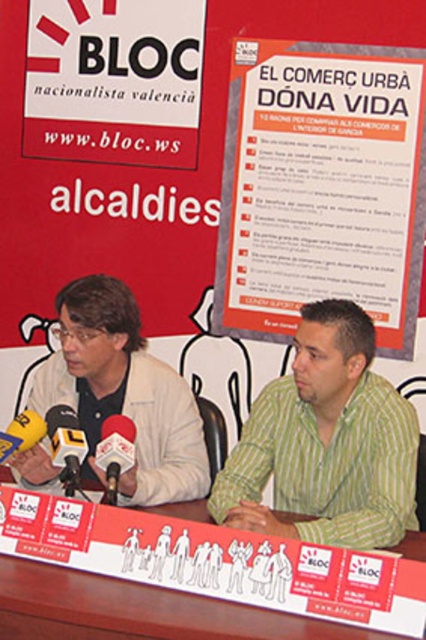
Question: In this image, where is green striped shirt at center located relative to wooden table at lower center?

Choices:
 (A) left
 (B) right

Answer: (B)

Question: Which of the following is the closest to the observer?

Choices:
 (A) metallic silver microphone at lower left
 (B) matte white microphone at center

Answer: (B)

Question: Is metallic silver microphone at lower left thinner than matte white microphone at center?

Choices:
 (A) no
 (B) yes

Answer: (A)

Question: Is matte beige jacket at left closer to the viewer compared to metallic silver microphone at lower left?

Choices:
 (A) yes
 (B) no

Answer: (B)

Question: Which object is farther from the camera taking this photo?

Choices:
 (A) metallic silver microphone at lower left
 (B) matte beige jacket at left
 (C) matte white microphone at center
 (D) green striped shirt at center

Answer: (B)

Question: Among these objects, which one is nearest to the camera?

Choices:
 (A) matte beige jacket at left
 (B) metallic silver microphone at lower left

Answer: (B)